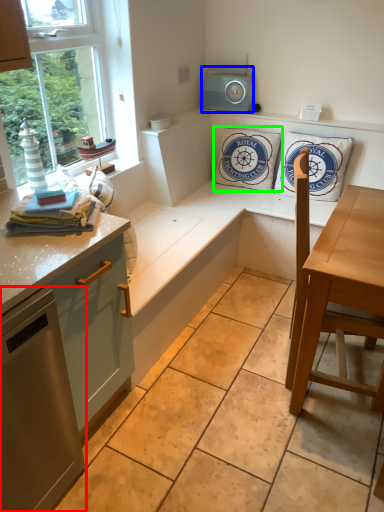
Question: Considering the real-world distances, which object is closest to appliance (highlighted by a red box)? speaker (highlighted by a blue box) or pillow (highlighted by a green box).

Choices:
 (A) speaker
 (B) pillow

Answer: (B)